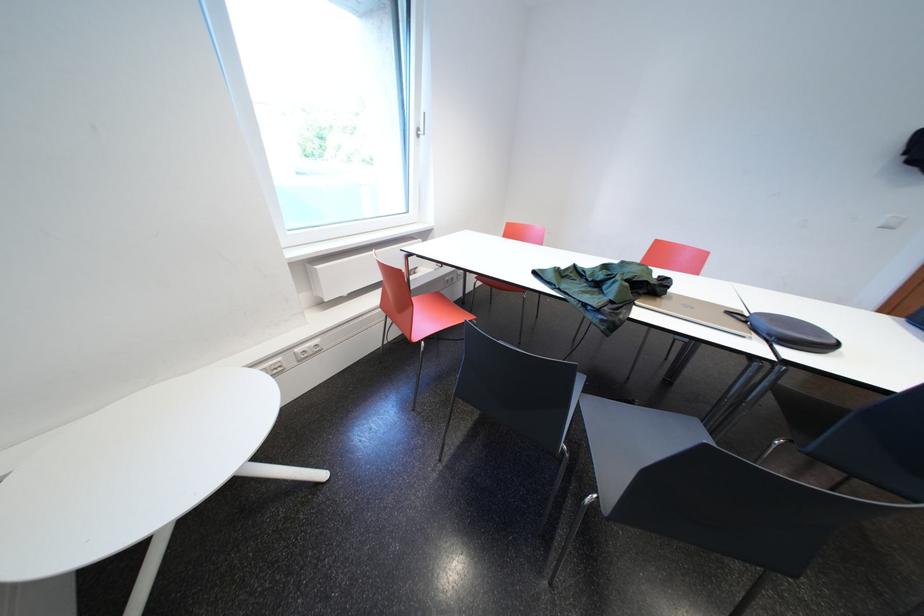
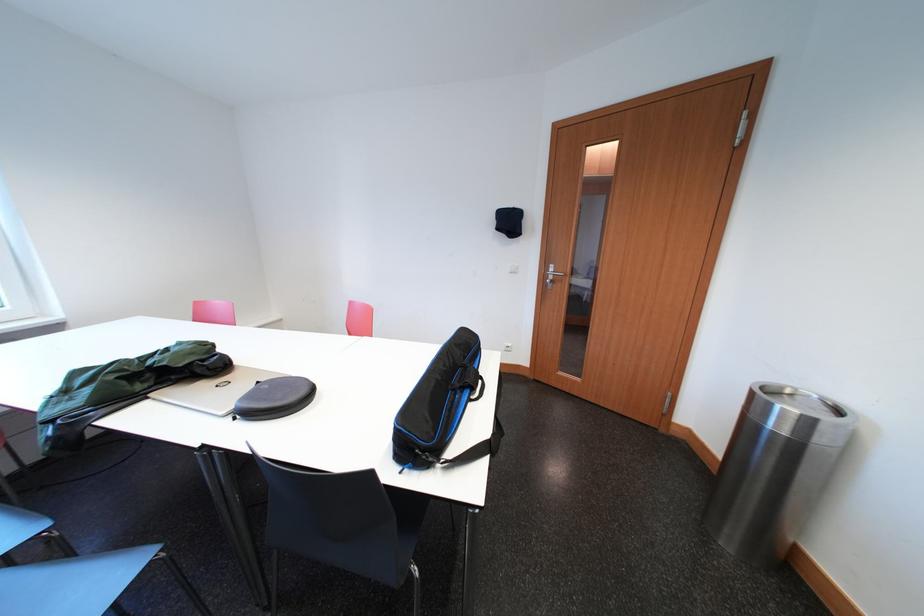
Where in the second image is the point corresponding to point (650, 296) from the first image?

(181, 382)